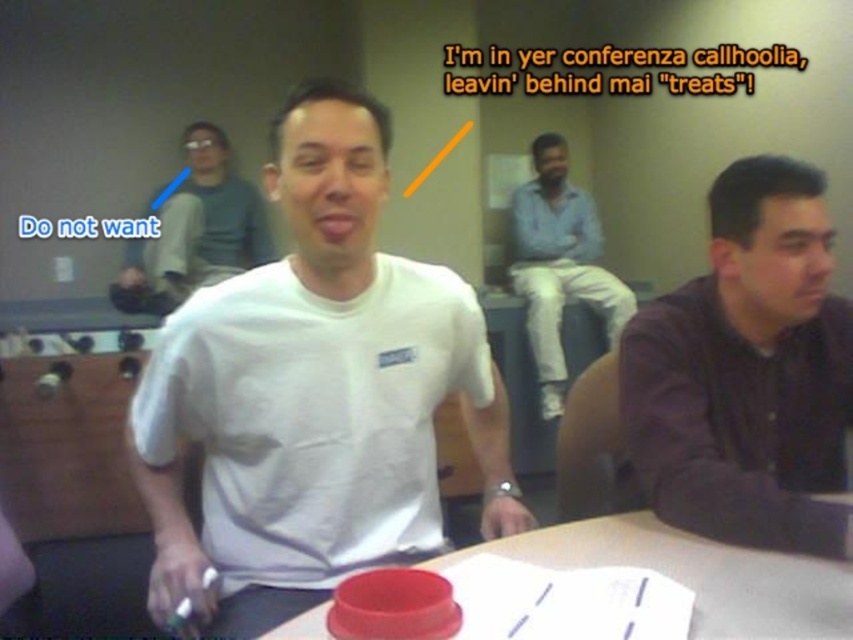
You are organizing a photo shoot and need to position two props correctly. The scene has a dark purple shirt at right and a smooth plastic lid at center. According to the image, which object is positioned to the right of the other?

The dark purple shirt at right is positioned to the right of the smooth plastic lid at center, so the smooth plastic lid at center is to the left of the dark purple shirt at right.

In the scene described, where exactly is the dark purple shirt at right located?

The dark purple shirt at right is located at point 0.583 on the x axis and 0.877 on the y axis.